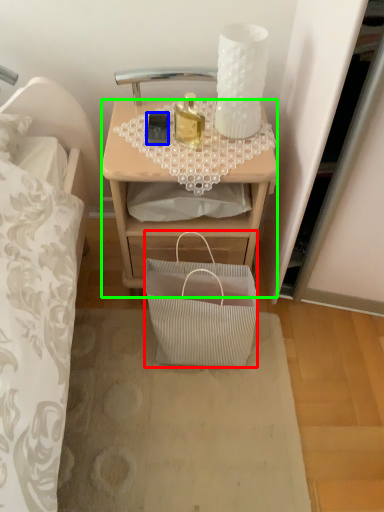
Question: Which object is the farthest from handbag (highlighted by a red box)? Choose among these: mobile phone (highlighted by a blue box) or desk (highlighted by a green box).

Choices:
 (A) mobile phone
 (B) desk

Answer: (A)